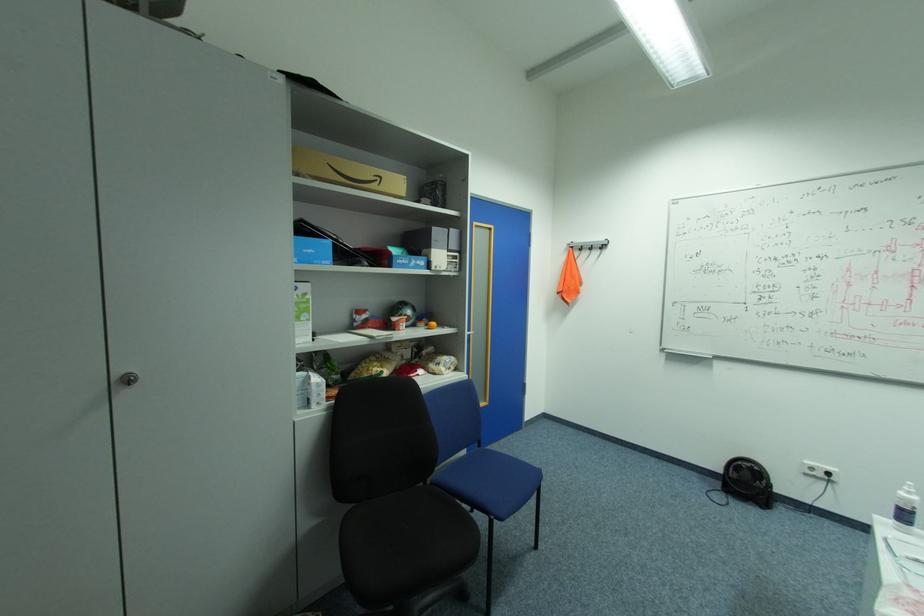
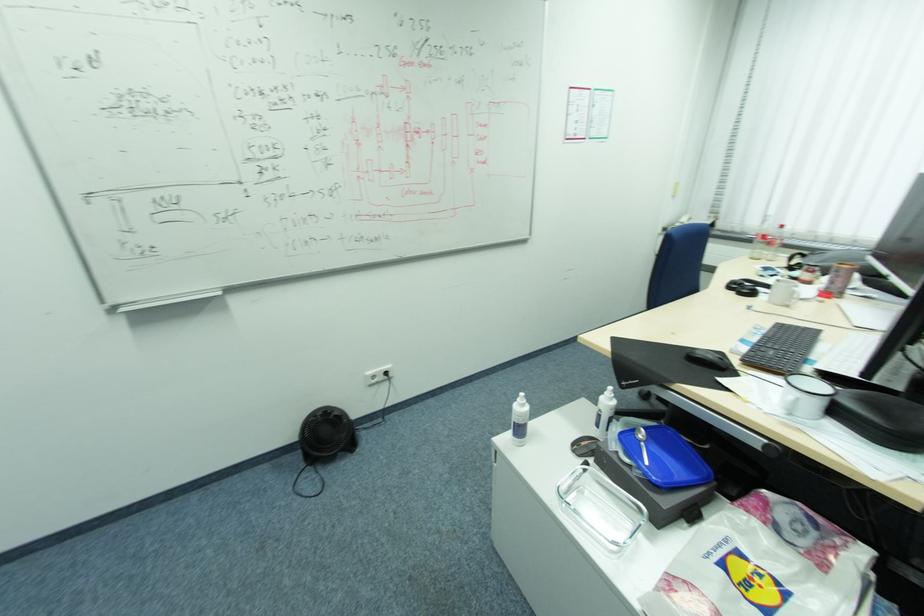
Where in the second image is the point corresponding to point (724, 484) from the first image?

(304, 456)